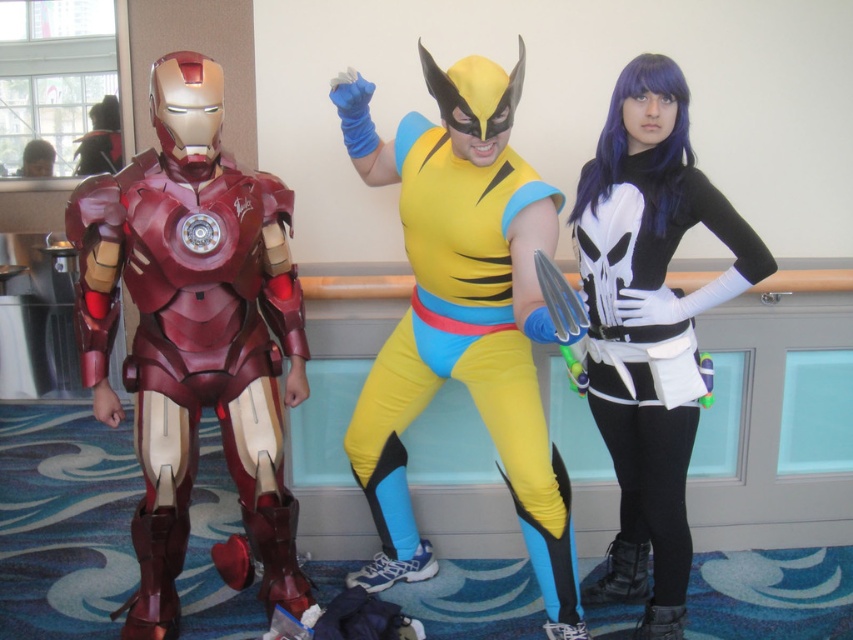
You are a photographer at a convention. You need to position the two characters so that both can fit within a 1.5 meter wide photo frame. The shiny metallic armor at left and the black matte punisher costume at right are currently standing side by side. Given their widths, will they both fit in the frame if placed next to each other?

The shiny metallic armor at left is wider than the black matte punisher costume at right. Since their combined widths must be less than or equal to 1.5 meters to fit, but without knowing the exact widths, we cannot confirm. However, since the shiny metallic armor is wider, it might exceed the frame when combined. Please measure both to ensure.

In the scene shown: You are a photographer at the convention and want to capture both the shiny metallic armor at left and the black matte punisher costume at right in a single frame. Which character should you position closer to the camera to ensure both are fully visible?

The shiny metallic armor at left is shorter than the black matte punisher costume at right, so you should position the shiny metallic armor at left closer to the camera to ensure both are fully visible.